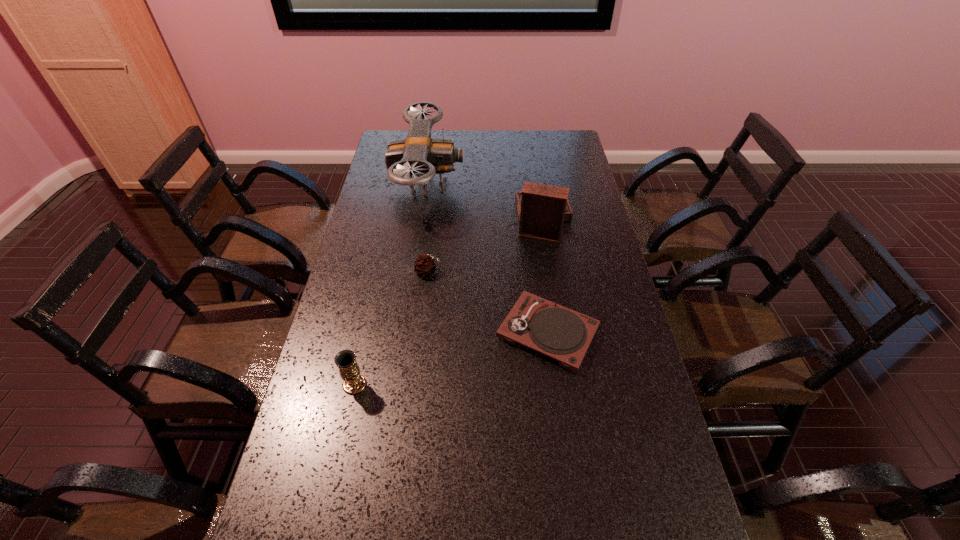
What are the coordinates of `vacant region between the fourth tallest object and the shorter phonograph_record` in the screenshot? It's located at (488, 302).

Select which object is the third closest to the tallest object. Please provide its 2D coordinates. Your answer should be formatted as a tuple, i.e. [(x, y)], where the tuple contains the x and y coordinates of a point satisfying the conditions above.

[(560, 333)]

You are a GUI agent. You are given a task and a screenshot of the screen. Output one action in this format:
    pyautogui.click(x=<x>, y=<y>)
    Task: Click on the object that is the fourth closest to the third shortest object
    The image size is (960, 540).
    Given the screenshot: What is the action you would take?
    pyautogui.click(x=542, y=209)

This screenshot has width=960, height=540. In order to click on vacant space that satisfies the following two spatial constraints: 1. with a leaf charm attached to the shortest object; 2. on the left side of the third nearest object in this screenshot , I will do [421, 333].

Locate an element on the screen. Image resolution: width=960 pixels, height=540 pixels. blank space that satisfies the following two spatial constraints: 1. on the front-facing side of the tallest object; 2. on the back side of the nearer phonograph_record is located at coordinates click(x=407, y=333).

Where is `free location that satisfies the following two spatial constraints: 1. with a leaf charm attached to the shortest object; 2. on the right side of the third nearest object`? free location that satisfies the following two spatial constraints: 1. with a leaf charm attached to the shortest object; 2. on the right side of the third nearest object is located at coordinates (421, 333).

Where is `vacant space that satisfies the following two spatial constraints: 1. on the front side of the taller phonograph_record; 2. with a leaf charm attached to the pinecone`? The height and width of the screenshot is (540, 960). vacant space that satisfies the following two spatial constraints: 1. on the front side of the taller phonograph_record; 2. with a leaf charm attached to the pinecone is located at coordinates (545, 272).